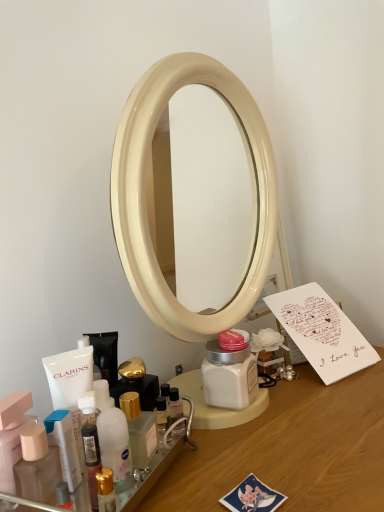
The width and height of the screenshot is (384, 512). Find the location of `vacant area on top of translucent plastic bottle at lower left, acting as the 3th toiletry starting from the left (from a real-world perspective)`. vacant area on top of translucent plastic bottle at lower left, acting as the 3th toiletry starting from the left (from a real-world perspective) is located at coordinates (94, 449).